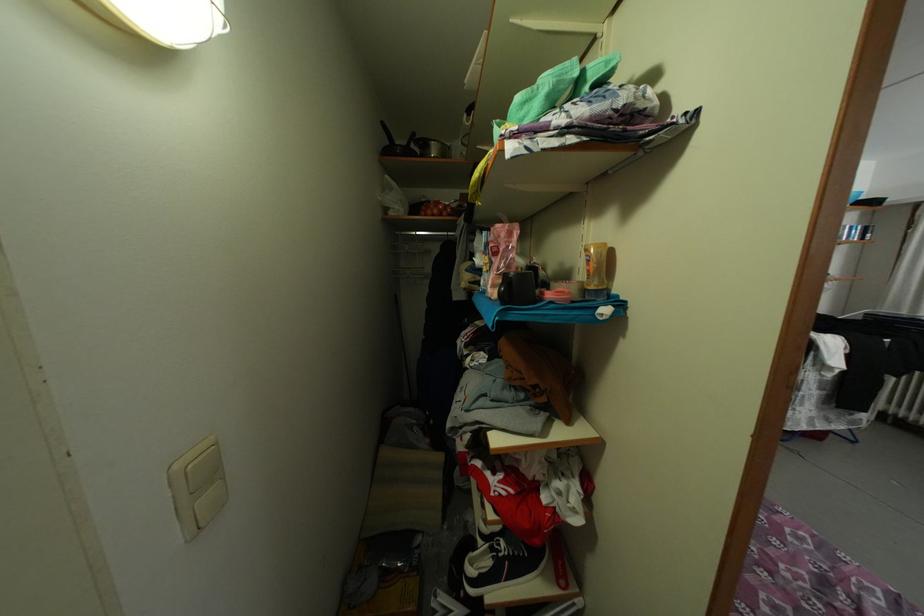
At what (x,y) coordinates should I click in order to perform the action: click on white light switch. Please return your answer as a coordinate pair (x, y). The height and width of the screenshot is (616, 924). Looking at the image, I should click on (198, 487).